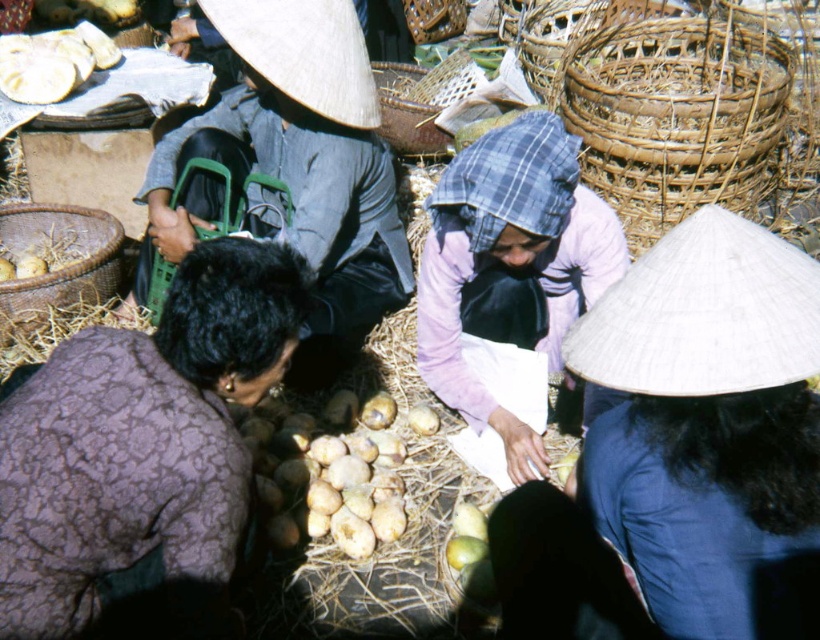
You are a customer at this market and want to place an order between the white straw hat at lower right and the brown woven basket at lower left. If you can only reach 7 feet, will you be able to reach both items without moving?

The white straw hat at lower right is 7.68 feet away from the brown woven basket at lower left. Since your reach is only 7 feet, you cannot simultaneously reach both items without moving.